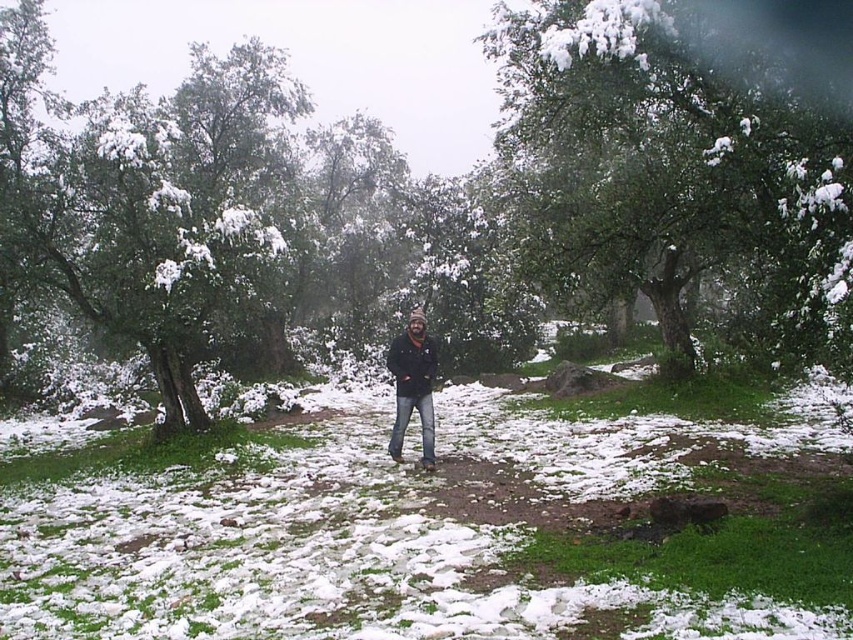
Consider the image. You are standing in the winter forest scene and want to take a photo of the white fluffy snow at center and the green textured tree at upper center. Which object should you focus on first if you want to capture both in one shot without moving the camera?

You should focus on the white fluffy snow at center first because it is closer to the camera than the green textured tree at upper center, allowing both to be in focus when using a shallow depth of field.

You are standing at point (430, 420) and want to walk to the forest edge. Can you see the forest edge from your current position, considering the trees and snow around point (567, 102)?

Point (567, 102) is behind point (430, 420). Since the trees around point (567, 102) are between you and the forest edge, they might block your view.

You are a photographer trying to capture the green textured tree at upper center in your shot. However, you notice the black matte jacket at center might block your view. Based on the scene, can you tell if the tree is visible behind the jacket?

The green textured tree at upper center is in front of the black matte jacket at center, so the tree is visible in front of the jacket and not blocked by it.